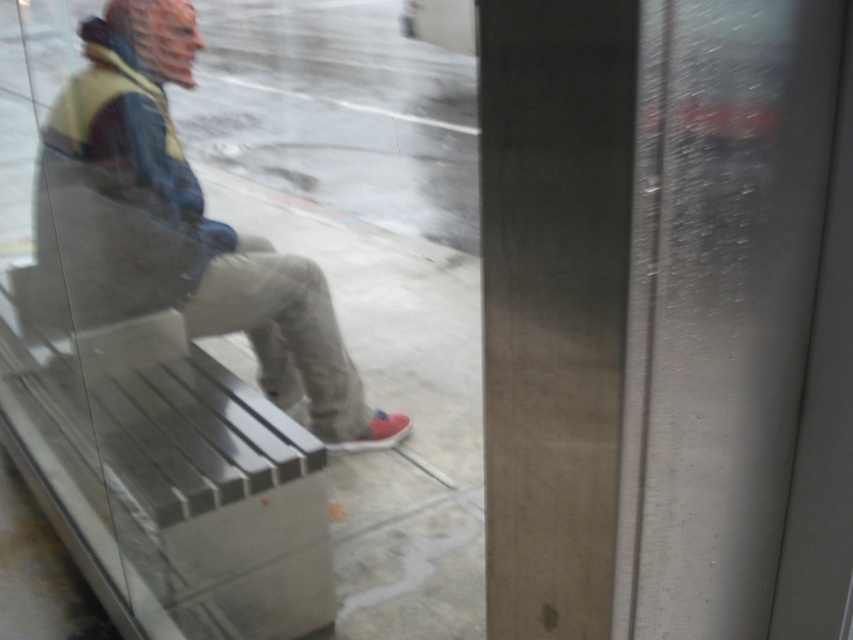
Who is higher up, matte black jacket at center or red suede shoe at lower center?

matte black jacket at center is above.

Does matte black jacket at center appear on the right side of red suede shoe at lower center?

Incorrect, matte black jacket at center is not on the right side of red suede shoe at lower center.

Find the location of a particular element. The width and height of the screenshot is (853, 640). matte black jacket at center is located at coordinates [x=183, y=218].

I want to click on matte black jacket at center, so click(183, 218).